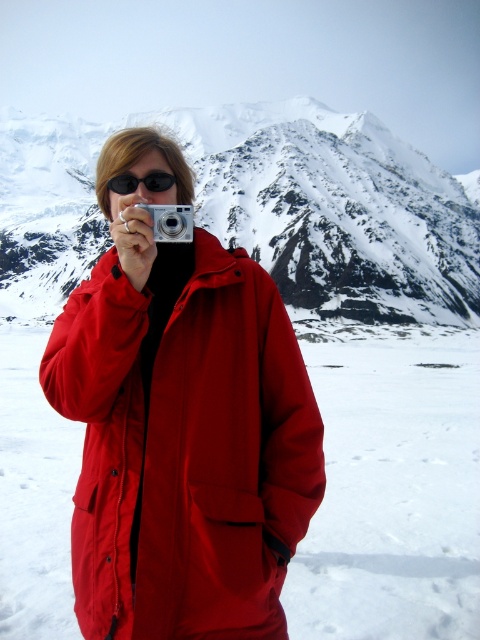
Is matte red jacket at center above silver metallic camera at center?

Actually, matte red jacket at center is below silver metallic camera at center.

Is matte red jacket at center bigger than silver metallic camera at center?

Yes, matte red jacket at center is bigger than silver metallic camera at center.

Which is in front, point (93, 516) or point (180, 216)?

Point (93, 516) is in front.

The height and width of the screenshot is (640, 480). Find the location of `matte red jacket at center`. matte red jacket at center is located at coordinates click(184, 445).

Consider the image. Can you confirm if snowy granite mountain at upper center is thinner than black plastic goggles at center?

Incorrect, snowy granite mountain at upper center's width is not less than black plastic goggles at center's.

Does snowy granite mountain at upper center appear over black plastic goggles at center?

Yes.

Between point (85, 170) and point (134, 180), which one is positioned in front?

Point (134, 180) is more forward.

What are the coordinates of `snowy granite mountain at upper center` in the screenshot? It's located at (335, 209).

Can you confirm if silver metallic camera at center is positioned to the right of black plastic goggles at center?

Yes, silver metallic camera at center is to the right of black plastic goggles at center.

Between point (190, 230) and point (116, 188), which one is positioned behind?

The point (116, 188) is behind.

Between point (182, 236) and point (168, 188), which one is positioned behind?

The point (168, 188) is more distant.

Identify the location of silver metallic camera at center. This screenshot has height=640, width=480. (170, 221).